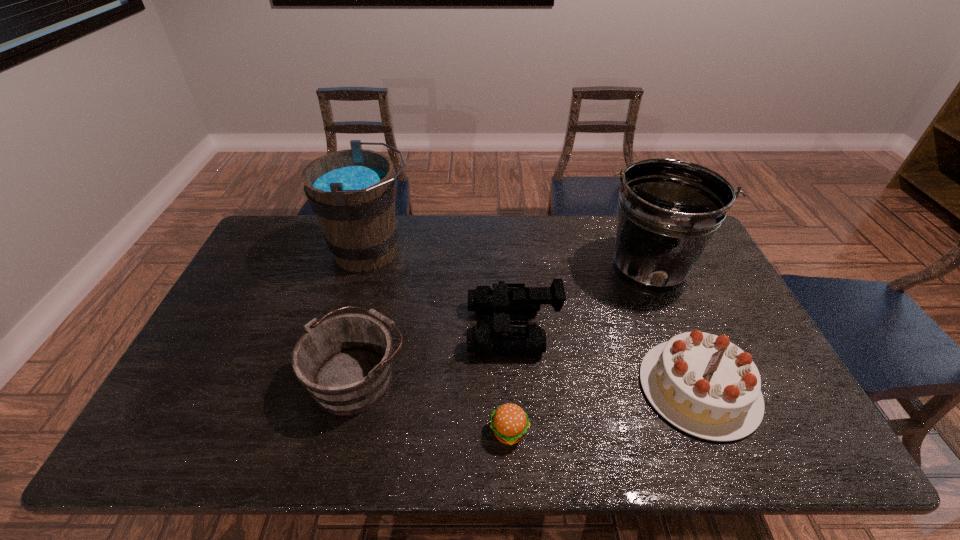
In order to click on free space located 0.120m on the front lenses of the binoculars in this screenshot , I will do (x=425, y=329).

You are a GUI agent. You are given a task and a screenshot of the screen. Output one action in this format:
    pyautogui.click(x=<x>, y=<y>)
    Task: Click on the free space located 0.090m on the left of the nearer wine bucket
    
    Given the screenshot: What is the action you would take?
    pyautogui.click(x=274, y=376)

Locate an element on the screen. Image resolution: width=960 pixels, height=540 pixels. free space located on the left of the birthday cake is located at coordinates pos(558,388).

The height and width of the screenshot is (540, 960). Find the location of `vacant region located on the left of the hamburger`. vacant region located on the left of the hamburger is located at coordinates (326, 431).

Locate an element on the screen. The width and height of the screenshot is (960, 540). wine bucket at the far edge is located at coordinates (352, 192).

Where is `bucket at the far edge`? The image size is (960, 540). bucket at the far edge is located at coordinates (669, 209).

The image size is (960, 540). In order to click on wine bucket at the near edge in this screenshot , I will do `click(345, 361)`.

Find the location of a particular element. The image size is (960, 540). birthday cake present at the near edge is located at coordinates (703, 384).

The width and height of the screenshot is (960, 540). In order to click on hamburger that is at the near edge in this screenshot , I will do `click(509, 422)`.

The width and height of the screenshot is (960, 540). I want to click on bucket situated at the right edge, so click(669, 209).